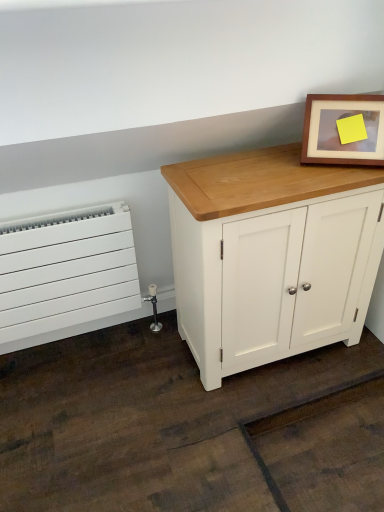
Find the location of a particular element. empty space that is in between white painted wood cabinet at center and white matte radiator at left is located at coordinates (118, 366).